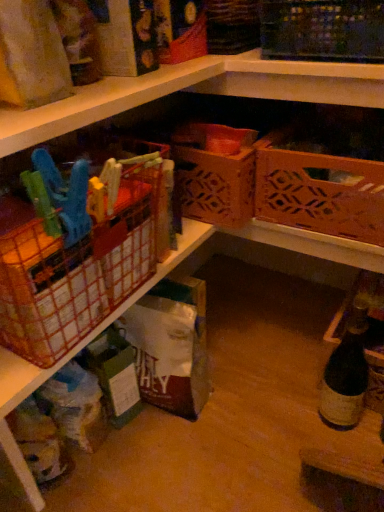
Question: In the image, is brown cardboard box at center on the left side or the right side of orange plastic basket at left, the 3th basket in the right-to-left sequence?

Choices:
 (A) left
 (B) right

Answer: (B)

Question: From a real-world perspective, is brown cardboard box at center physically located above or below orange plastic basket at left, which is counted as the first basket, starting from the left?

Choices:
 (A) below
 (B) above

Answer: (A)

Question: Based on their relative distances, which object is nearer to the orange plastic basket at left, which is counted as the first basket, starting from the left?

Choices:
 (A) brown cardboard box at center
 (B) wooden lattice basket at upper right, the third basket viewed from the left
 (C) dark brown glass bottle at lower right
 (D) wooden lattice basket at center, which appears as the second basket when viewed from the left

Answer: (A)

Question: Based on their relative distances, which object is nearer to the dark brown glass bottle at lower right?

Choices:
 (A) brown cardboard box at center
 (B) wooden lattice basket at upper right, the third basket viewed from the left
 (C) wooden lattice basket at center, arranged as the 2th basket when viewed from the right
 (D) orange plastic basket at left, which is counted as the first basket, starting from the left

Answer: (B)